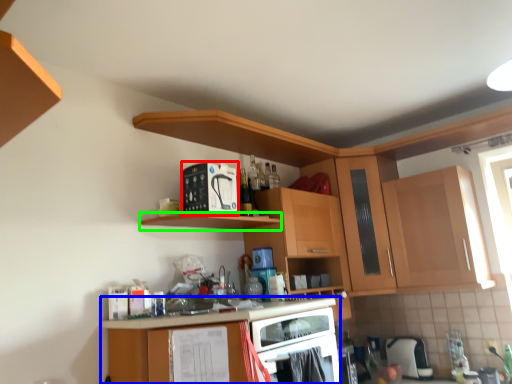
Question: Based on their relative distances, which object is farther from appliance (highlighted by a red box)? Choose from cabinetry (highlighted by a blue box) and shelf (highlighted by a green box).

Choices:
 (A) cabinetry
 (B) shelf

Answer: (A)